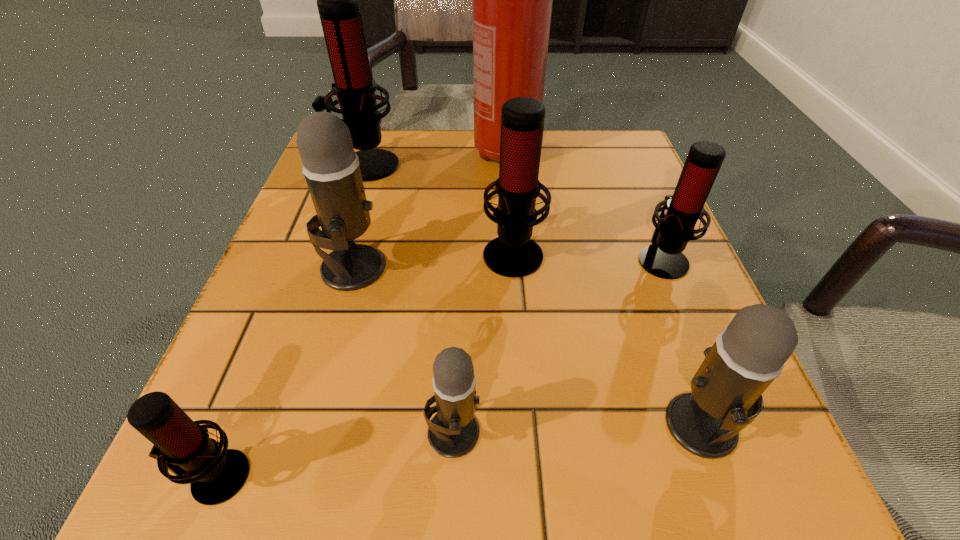
Find the location of `the smallest gray microphone`. the smallest gray microphone is located at coordinates (453, 432).

Where is `the second gray microphone from left to right`? The width and height of the screenshot is (960, 540). the second gray microphone from left to right is located at coordinates (453, 432).

You are a GUI agent. You are given a task and a screenshot of the screen. Output one action in this format:
    pyautogui.click(x=<x>, y=<y>)
    Task: Click on the smallest red microphone
    The height and width of the screenshot is (540, 960).
    Given the screenshot: What is the action you would take?
    [x=181, y=445]

You are a GUI agent. You are given a task and a screenshot of the screen. Output one action in this format:
    pyautogui.click(x=<x>, y=<y>)
    Task: Click on the free space located 0.230m on the handle side the tallest object
    This screenshot has height=540, width=960.
    Given the screenshot: What is the action you would take?
    pyautogui.click(x=513, y=253)

Where is `vacant space located on the front of the farthest red microphone`? This screenshot has width=960, height=540. vacant space located on the front of the farthest red microphone is located at coordinates [345, 225].

Locate an element on the screen. free spot located on the right of the third microphone from right to left is located at coordinates (612, 252).

You are a GUI agent. You are given a task and a screenshot of the screen. Output one action in this format:
    pyautogui.click(x=<x>, y=<y>)
    Task: Click on the blank space located 0.090m on the right of the leftmost gray microphone
    The height and width of the screenshot is (540, 960).
    Given the screenshot: What is the action you would take?
    pyautogui.click(x=439, y=267)

Locate an element on the screen. This screenshot has height=540, width=960. free space located 0.290m on the left of the third biggest red microphone is located at coordinates (468, 259).

Where is `free space located 0.380m on the back of the second smallest gray microphone`? This screenshot has width=960, height=540. free space located 0.380m on the back of the second smallest gray microphone is located at coordinates tap(624, 213).

Locate an element on the screen. Image resolution: width=960 pixels, height=540 pixels. blank space located on the right of the fourth microphone from right to left is located at coordinates (577, 431).